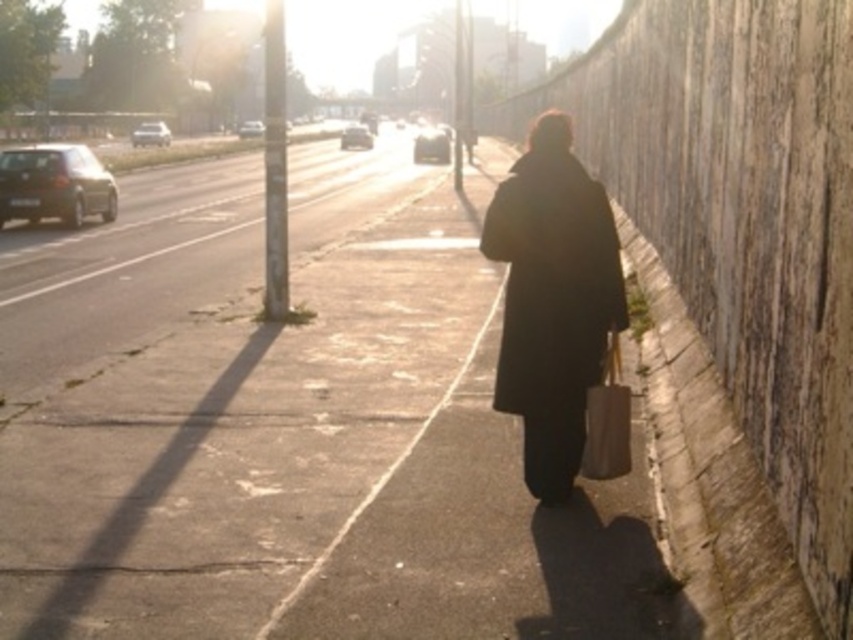
Question: Can you confirm if matte beige shopping bag at right is bigger than shiny silver sedan at left?

Choices:
 (A) no
 (B) yes

Answer: (A)

Question: Estimate the real-world distances between objects in this image. Which object is closer to the shiny black sedan at left?

Choices:
 (A) smooth concrete sidewalk at center
 (B) matte beige shopping bag at right

Answer: (A)

Question: Which point is farther to the camera?

Choices:
 (A) (627, 429)
 (B) (47, 211)
 (C) (260, 129)
 (D) (445, 150)

Answer: (C)

Question: Can you confirm if smooth concrete sidewalk at center is positioned below shiny silver car at center?

Choices:
 (A) yes
 (B) no

Answer: (A)

Question: Where is shiny silver sedan at center located in relation to metallic silver car at upper left in the image?

Choices:
 (A) above
 (B) below

Answer: (A)

Question: Among these points, which one is farthest from the camera?

Choices:
 (A) (624, 403)
 (B) (115, 205)
 (C) (140, 134)

Answer: (C)